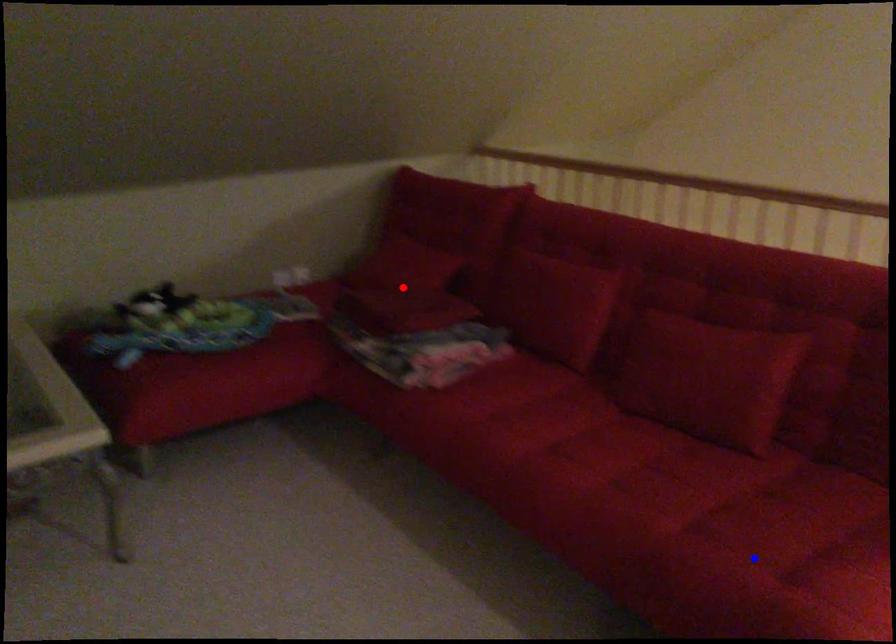
Question: Two points are marked on the image. Which point is closer to the camera?

Choices:
 (A) Blue point is closer.
 (B) Red point is closer.

Answer: (A)